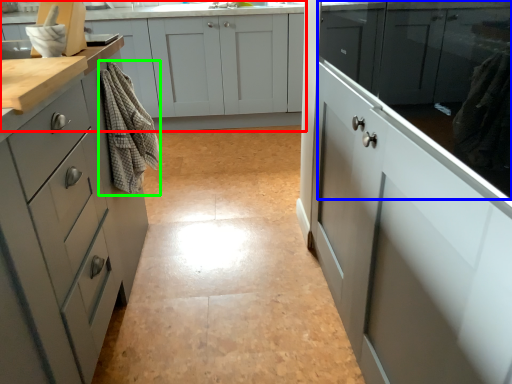
Question: Based on their relative distances, which object is farther from cabinetry (highlighted by a red box)? Choose from cabinetry (highlighted by a blue box) and material (highlighted by a green box).

Choices:
 (A) cabinetry
 (B) material

Answer: (A)